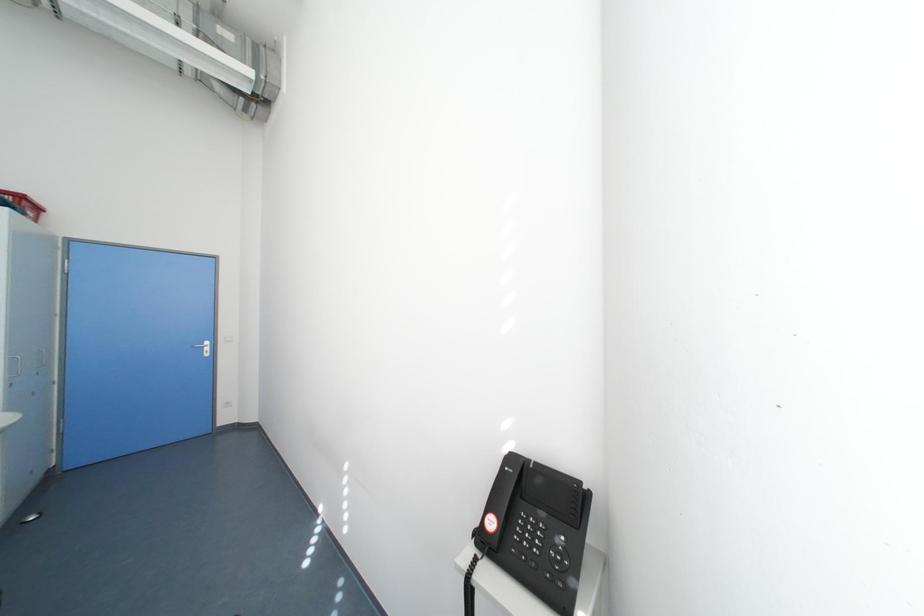
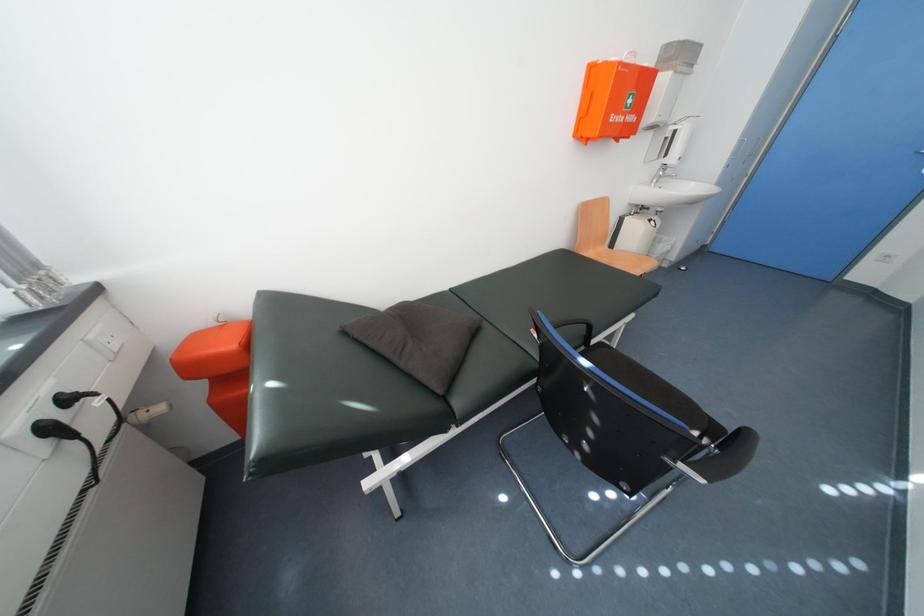
Based on the continuous images, in which direction is the camera rotating?

The camera rotated toward left-down.